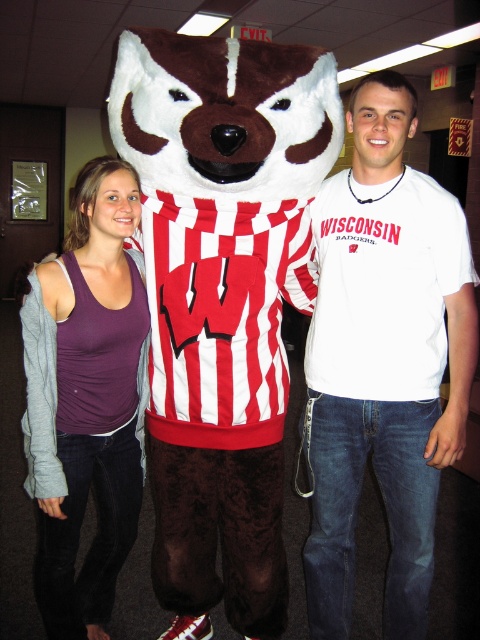
Consider the image. Between brown plush badger at center and purple matte tank top at center-left, which one appears on the right side from the viewer's perspective?

brown plush badger at center

You are a GUI agent. You are given a task and a screenshot of the screen. Output one action in this format:
    pyautogui.click(x=<x>, y=<y>)
    Task: Click on the brown plush badger at center
    The height and width of the screenshot is (640, 480).
    Given the screenshot: What is the action you would take?
    pyautogui.click(x=222, y=298)

Between brown plush badger at center and white cotton t-shirt at center, which one appears on the right side from the viewer's perspective?

Positioned to the right is white cotton t-shirt at center.

Does point (262, 204) lie in front of point (404, 449)?

That is True.

Locate an element on the screen. This screenshot has height=640, width=480. brown plush badger at center is located at coordinates (222, 298).

Does white cotton t-shirt at center appear over purple matte tank top at center-left?

Yes.

Is white cotton t-shirt at center closer to the viewer compared to purple matte tank top at center-left?

Yes.

What do you see at coordinates (384, 360) in the screenshot? I see `white cotton t-shirt at center` at bounding box center [384, 360].

Where is `white cotton t-shirt at center`? This screenshot has height=640, width=480. white cotton t-shirt at center is located at coordinates (384, 360).